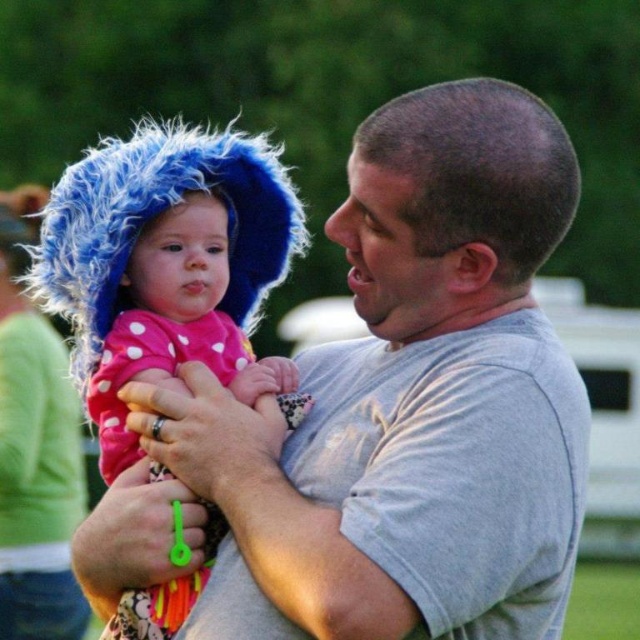
Question: Does pink polka dot fabric at center appear under fuzzy blue hat at upper left?

Choices:
 (A) yes
 (B) no

Answer: (B)

Question: Which point appears farthest from the camera in this image?

Choices:
 (A) (67, 385)
 (B) (381, 524)
 (C) (144, 618)

Answer: (A)

Question: Which point appears closest to the camera in this image?

Choices:
 (A) (12, 572)
 (B) (349, 429)

Answer: (B)

Question: Can you confirm if gray cotton shirt at center is positioned above pink polka dot fabric at center?

Choices:
 (A) no
 (B) yes

Answer: (B)

Question: Which point is closer to the camera taking this photo?

Choices:
 (A) (40, 570)
 (B) (230, 624)

Answer: (B)

Question: Is pink polka dot fabric at center smaller than fuzzy blue hat at upper left?

Choices:
 (A) yes
 (B) no

Answer: (A)